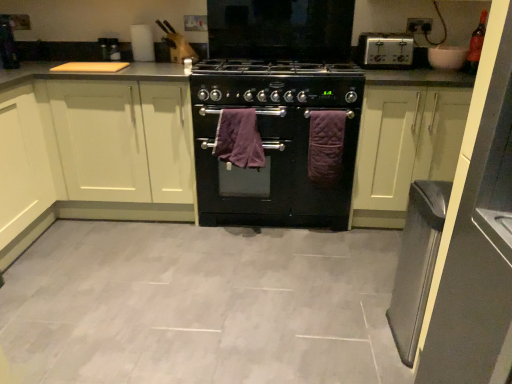
Question: Is black matte gas stove at center in front of or behind purple quilted towel at center, the first bath towel when ordered from right to left, in the image?

Choices:
 (A) front
 (B) behind

Answer: (A)

Question: Which is correct: black matte gas stove at center is inside purple quilted towel at center, the first bath towel when ordered from right to left, or outside of it?

Choices:
 (A) outside
 (B) inside

Answer: (A)

Question: Estimate the real-world distances between objects in this image. Which object is closer to the white matte cabinet at left, the 2th cabinetry viewed from the right?

Choices:
 (A) purple quilted towel at center, the 2th bath towel from the left
 (B) white matte cabinet at center, which appears as the first cabinetry when viewed from the right
 (C) black matte gas stove at center
 (D) purple quilted bath towel at center, the 2th bath towel positioned from the right
 (E) silver metallic toaster at upper right

Answer: (D)

Question: Which is nearer to the black matte gas stove at center?

Choices:
 (A) white matte cabinet at center, the 2th cabinetry in the left-to-right sequence
 (B) silver metallic toaster at upper right
 (C) purple quilted towel at center, the 2th bath towel from the left
 (D) purple quilted bath towel at center, the first bath towel from the left
 (E) white matte cabinet at left, the 2th cabinetry viewed from the right

Answer: (D)